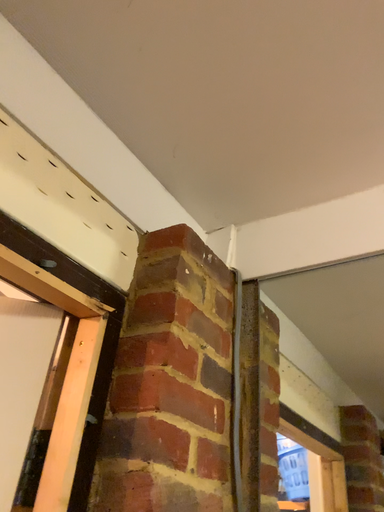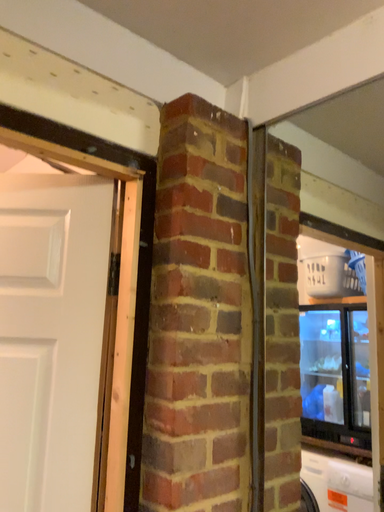
Question: How did the camera likely rotate when shooting the video?

Choices:
 (A) rotated right
 (B) rotated left

Answer: (B)